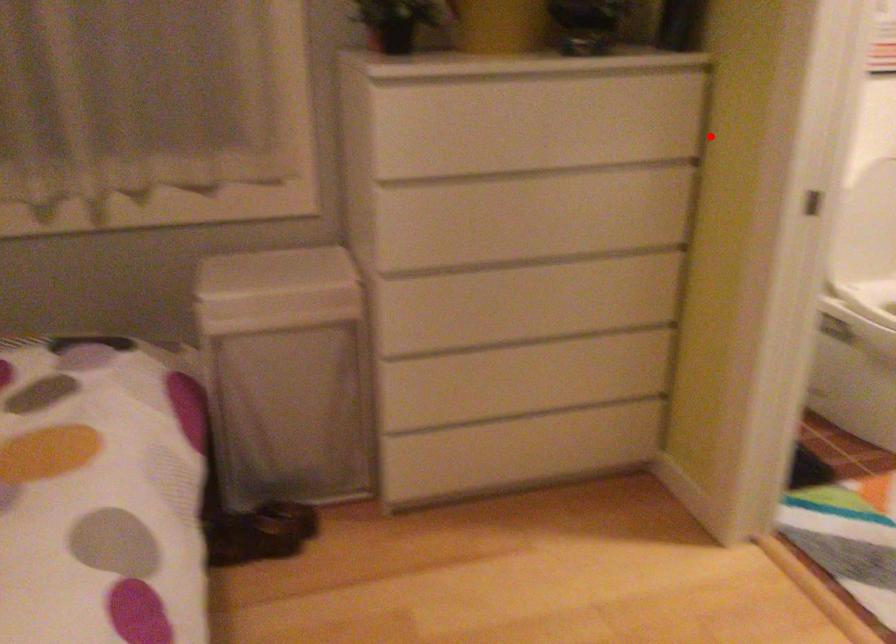
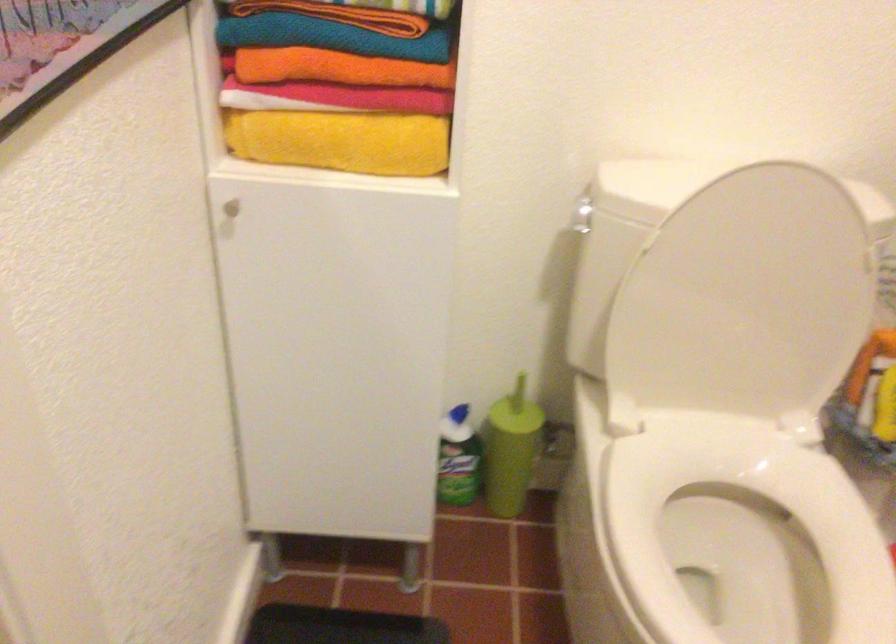
Question: I am providing you with two images of the same scene from different viewpoints. A red point is shown in image1. For the corresponding object point in image2, is it positioned nearer or farther from the camera?

Choices:
 (A) Nearer
 (B) Farther

Answer: (A)